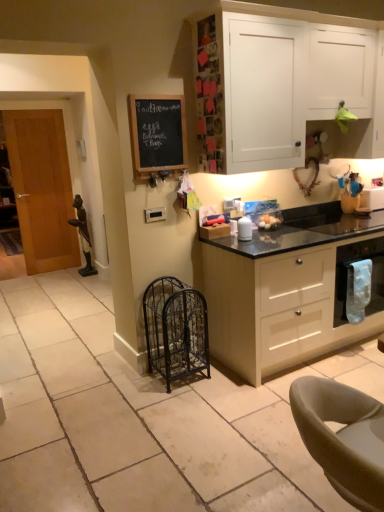
This screenshot has height=512, width=384. Find the location of `free spot to the right of black wrought iron cage at lower center`. free spot to the right of black wrought iron cage at lower center is located at coordinates (222, 382).